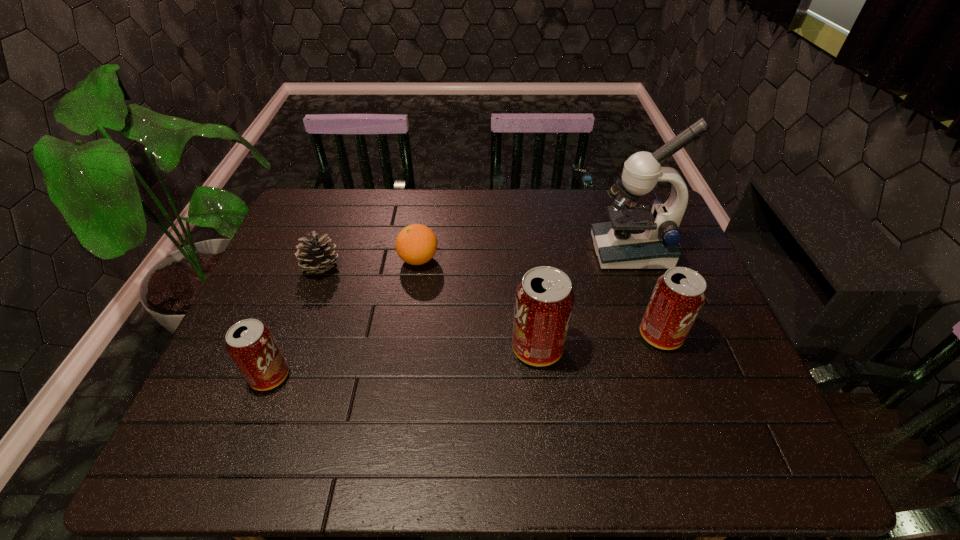
Locate an element on the screen. This screenshot has width=960, height=540. soda can that is at the right edge is located at coordinates (678, 296).

The height and width of the screenshot is (540, 960). I want to click on microscope present at the right edge, so click(x=638, y=237).

Locate an element on the screen. object that is at the near left corner is located at coordinates (250, 343).

This screenshot has height=540, width=960. In order to click on object present at the far right corner in this screenshot , I will do `click(638, 237)`.

The height and width of the screenshot is (540, 960). Identify the location of free point at the far edge. (517, 232).

This screenshot has height=540, width=960. In order to click on vacant space at the near edge of the desktop in this screenshot , I will do `click(618, 416)`.

In the image, there is a desktop. Identify the location of free space at the right edge. pyautogui.click(x=719, y=332).

Identify the location of vacant space at the near left corner of the desktop. (226, 390).

Image resolution: width=960 pixels, height=540 pixels. I want to click on unoccupied position between the rightmost soda can and the pinecone, so click(x=492, y=301).

The height and width of the screenshot is (540, 960). I want to click on free space between the second soda can from right to left and the second tallest soda can, so click(x=599, y=342).